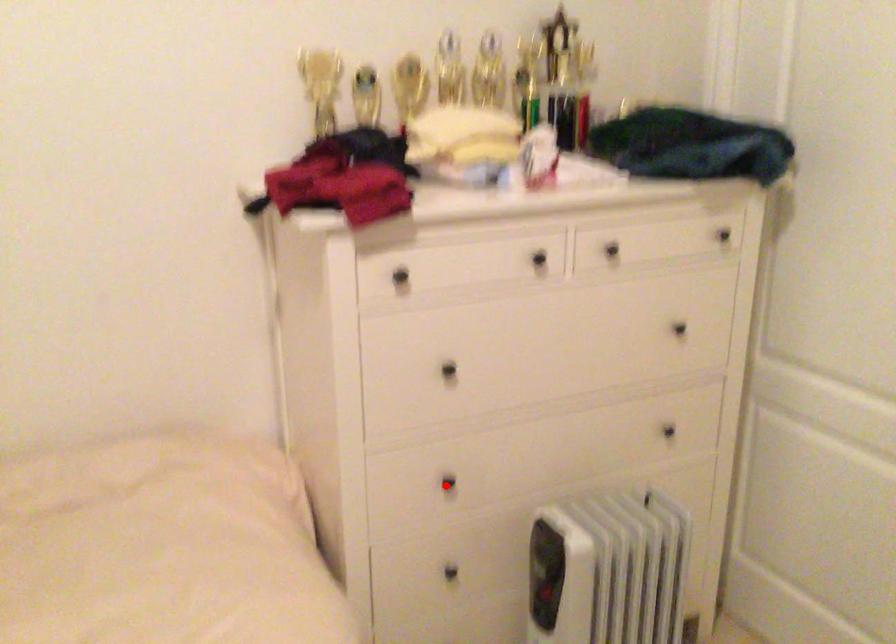
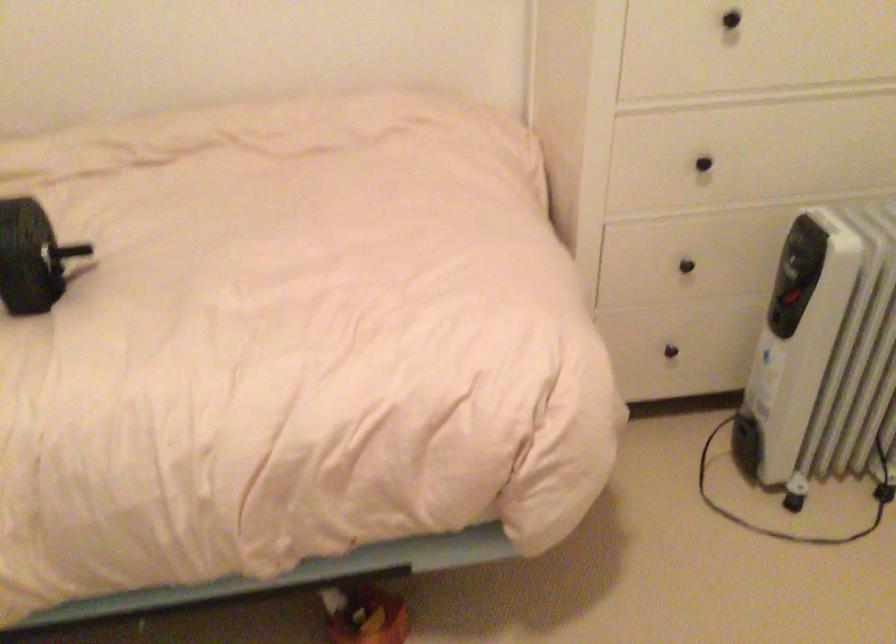
Question: I am providing you with two images of the same scene from different viewpoints. Given a red point in image1, look at the same physical point in image2. Is it:

Choices:
 (A) Closer to the viewpoint
 (B) Farther from the viewpoint

Answer: (A)